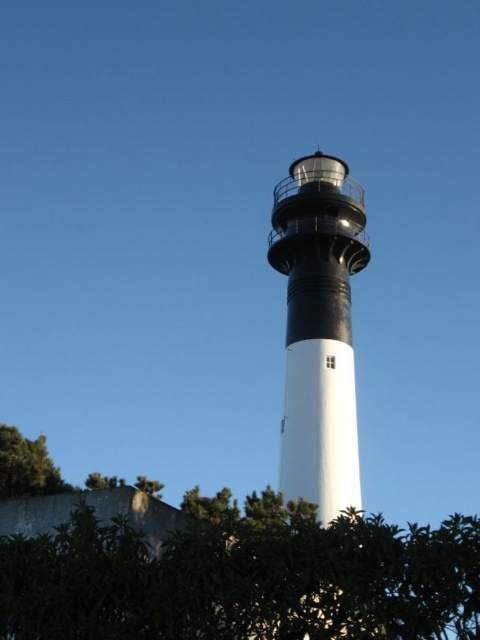
From the picture: Which is below, green leafy hedge at lower left or white matte/light tower at center?

green leafy hedge at lower left

Can you confirm if green leafy hedge at lower left is taller than white matte/light tower at center?

In fact, green leafy hedge at lower left may be shorter than white matte/light tower at center.

The image size is (480, 640). In order to click on green leafy hedge at lower left in this screenshot , I will do [244, 580].

Where is `green leafy hedge at lower left`? This screenshot has height=640, width=480. green leafy hedge at lower left is located at coordinates (244, 580).

Who is taller, white matte/light tower at center or green leafy tree at lower left?

white matte/light tower at center

Does white matte/light tower at center have a larger size compared to green leafy tree at lower left?

Yes, white matte/light tower at center is bigger than green leafy tree at lower left.

Does point (321, 209) lie behind point (4, 465)?

Yes, point (321, 209) is behind point (4, 465).

The height and width of the screenshot is (640, 480). In order to click on white matte/light tower at center in this screenshot , I will do `click(319, 330)`.

Can you confirm if green leafy hedge at lower left is shorter than green leafy tree at lower left?

No, green leafy hedge at lower left is not shorter than green leafy tree at lower left.

Locate an element on the screen. green leafy hedge at lower left is located at coordinates (244, 580).

The image size is (480, 640). What do you see at coordinates (244, 580) in the screenshot? I see `green leafy hedge at lower left` at bounding box center [244, 580].

Find the location of a particular element. The height and width of the screenshot is (640, 480). green leafy hedge at lower left is located at coordinates (244, 580).